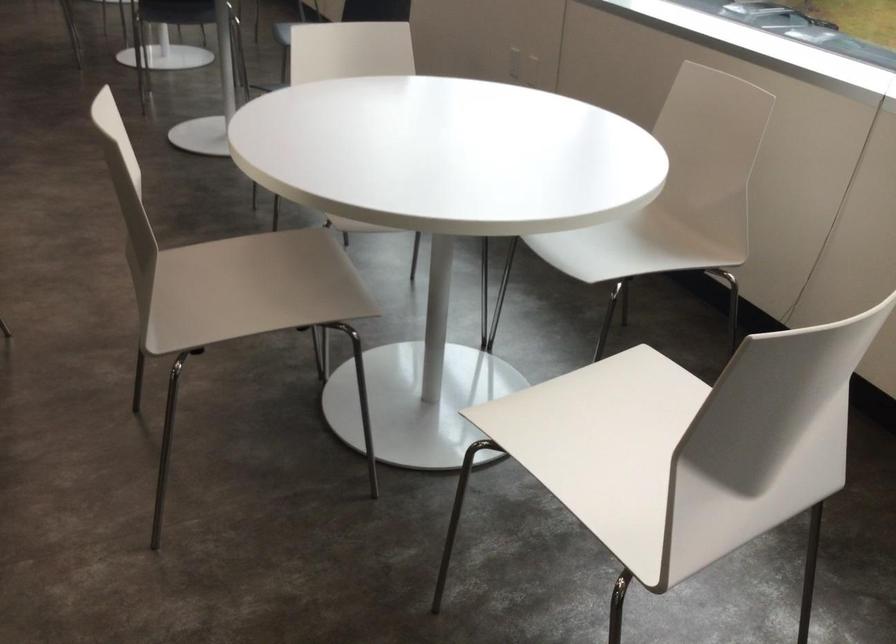
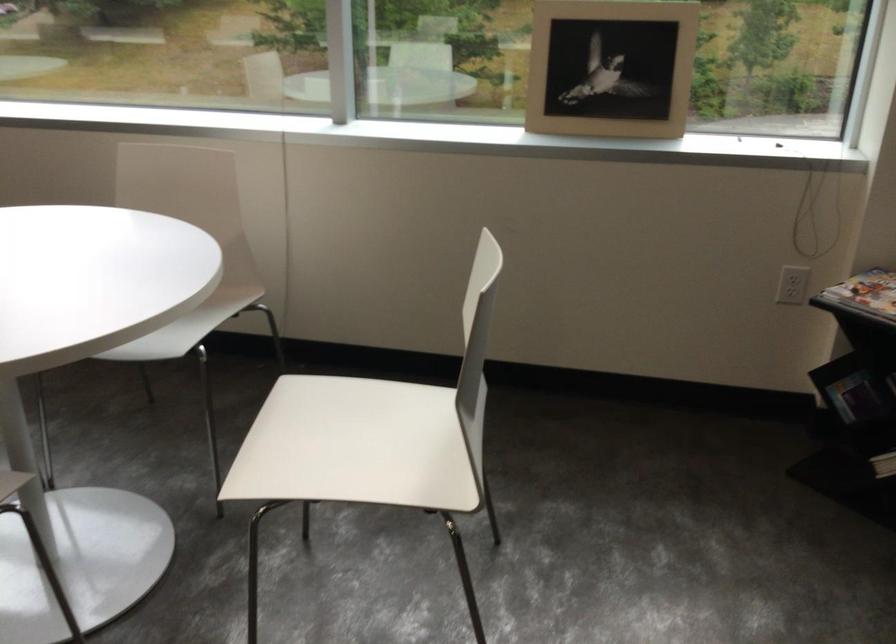
The point at (608, 446) is marked in the first image. Where is the corresponding point in the second image?

(356, 446)